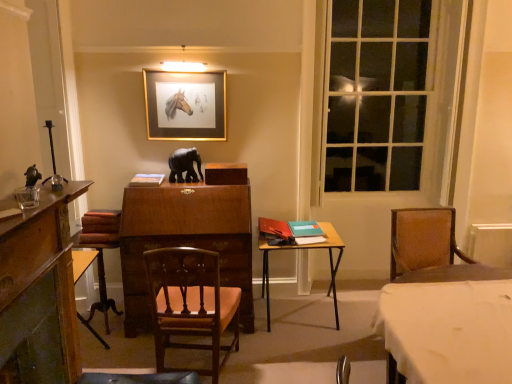
Question: Is wooden table at center, which appears as the first table when viewed from the back, beside white cloth-covered table at lower right, the 2th table viewed from the left?

Choices:
 (A) no
 (B) yes

Answer: (A)

Question: Considering the relative positions of wooden table at center, the second table when ordered from right to left, and white cloth-covered table at lower right, the first table from the front, in the image provided, is wooden table at center, the second table when ordered from right to left, in front of white cloth-covered table at lower right, the first table from the front,?

Choices:
 (A) no
 (B) yes

Answer: (A)

Question: Is wooden table at center, which is counted as the second table, starting from the front, looking in the opposite direction of white cloth-covered table at lower right, the first table from the front?

Choices:
 (A) yes
 (B) no

Answer: (B)

Question: From a real-world perspective, is wooden table at center, the second table when ordered from right to left, physically above white cloth-covered table at lower right, arranged as the 1th table when viewed from the right?

Choices:
 (A) no
 (B) yes

Answer: (A)

Question: Is wooden table at center, which is counted as the second table, starting from the front, aimed at white cloth-covered table at lower right, which is counted as the second table, starting from the back?

Choices:
 (A) yes
 (B) no

Answer: (B)

Question: Can you confirm if wooden table at center, the first table positioned from the left, is positioned to the right of white cloth-covered table at lower right, the first table from the front?

Choices:
 (A) yes
 (B) no

Answer: (B)

Question: Considering the relative sizes of clear glass window at right and wooden chair at center in the image provided, is clear glass window at right thinner than wooden chair at center?

Choices:
 (A) no
 (B) yes

Answer: (B)

Question: From a real-world perspective, is clear glass window at right positioned over wooden chair at center based on gravity?

Choices:
 (A) no
 (B) yes

Answer: (B)

Question: Is clear glass window at right shorter than wooden chair at center?

Choices:
 (A) yes
 (B) no

Answer: (B)

Question: Is clear glass window at right positioned in front of wooden chair at center?

Choices:
 (A) yes
 (B) no

Answer: (B)

Question: Is wooden chair at center completely or partially inside clear glass window at right?

Choices:
 (A) yes
 (B) no

Answer: (B)

Question: Considering the relative sizes of clear glass window at right and wooden chair at center in the image provided, is clear glass window at right wider than wooden chair at center?

Choices:
 (A) yes
 (B) no

Answer: (B)

Question: Could you tell me if wooden chair at center is facing white cloth-covered table at lower right, the 2th table viewed from the left?

Choices:
 (A) yes
 (B) no

Answer: (B)